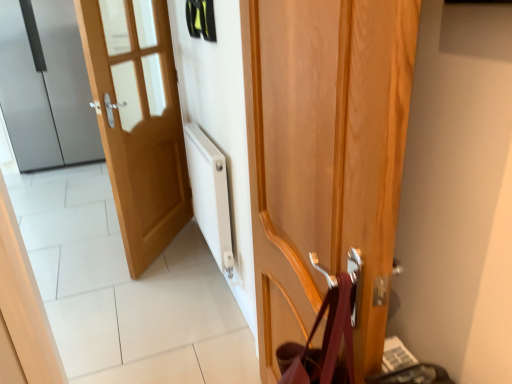
The width and height of the screenshot is (512, 384). I want to click on vacant area that is in front of light wood door at left, the 2th door viewed from the right, so click(148, 296).